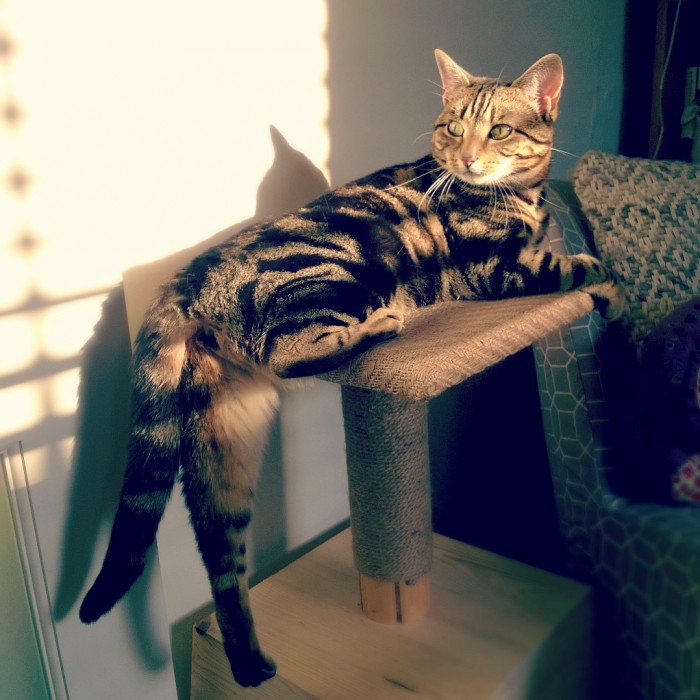
I want to click on chair, so click(587, 460).